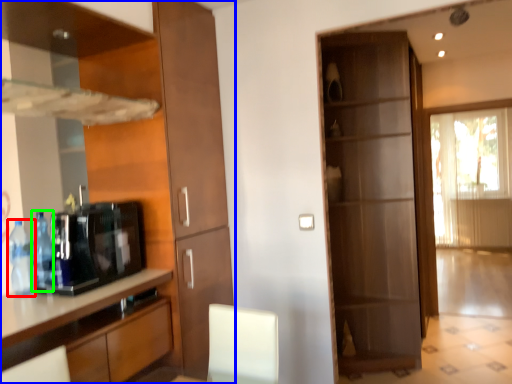
Question: Estimate the real-world distances between objects in this image. Which object is farther from bottle (highlighted by a red box), cabinetry (highlighted by a blue box) or bottle (highlighted by a green box)?

Choices:
 (A) cabinetry
 (B) bottle

Answer: (A)